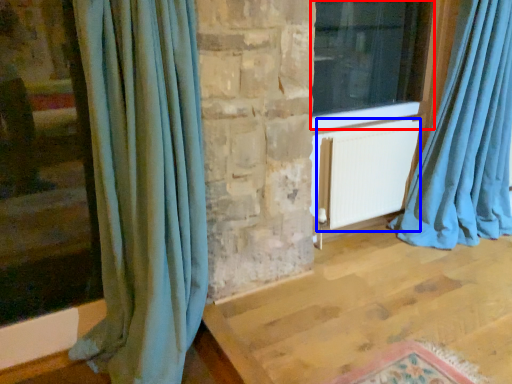
Question: Which object is further to the camera taking this photo, window (highlighted by a red box) or radiator (highlighted by a blue box)?

Choices:
 (A) window
 (B) radiator

Answer: (B)